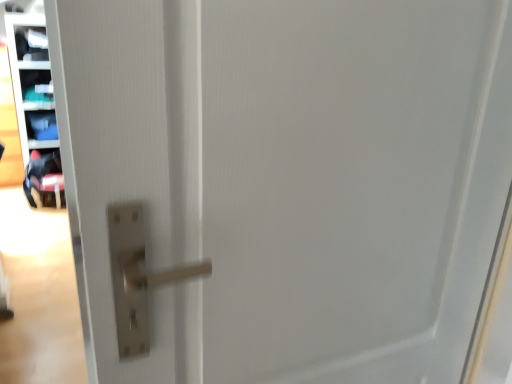
Question: Are matte plastic shelf at upper left, which ranks as the 3th shelf in bottom-to-top order, and matte plastic shelf at upper left, the fourth shelf ordered from the bottom, beside each other?

Choices:
 (A) no
 (B) yes

Answer: (A)

Question: Considering the relative positions of matte plastic shelf at upper left, which ranks as the 3th shelf in bottom-to-top order, and matte plastic shelf at upper left, the fourth shelf ordered from the bottom, in the image provided, is matte plastic shelf at upper left, which ranks as the 3th shelf in bottom-to-top order, to the left of matte plastic shelf at upper left, the fourth shelf ordered from the bottom, from the viewer's perspective?

Choices:
 (A) yes
 (B) no

Answer: (A)

Question: Is the depth of matte plastic shelf at upper left, which ranks as the 3th shelf in bottom-to-top order, less than that of matte plastic shelf at upper left, the fourth shelf ordered from the bottom?

Choices:
 (A) yes
 (B) no

Answer: (B)

Question: Is matte plastic shelf at upper left, which ranks as the 3th shelf in bottom-to-top order, to the right of matte plastic shelf at upper left, the first shelf positioned from the top, from the viewer's perspective?

Choices:
 (A) no
 (B) yes

Answer: (A)

Question: Is matte plastic shelf at upper left, the 2th shelf viewed from the top, not near matte plastic shelf at upper left, the fourth shelf ordered from the bottom?

Choices:
 (A) no
 (B) yes

Answer: (A)

Question: Considering the positions of matte plastic shelf at upper left, the fourth shelf ordered from the bottom, and matte plastic shelf at left, arranged as the first shelf when ordered from the bottom, in the image, is matte plastic shelf at upper left, the fourth shelf ordered from the bottom, taller or shorter than matte plastic shelf at left, arranged as the first shelf when ordered from the bottom,?

Choices:
 (A) tall
 (B) short

Answer: (A)

Question: Based on their positions, is matte plastic shelf at upper left, the fourth shelf ordered from the bottom, located to the left or right of matte plastic shelf at left, placed as the fourth shelf when sorted from top to bottom?

Choices:
 (A) left
 (B) right

Answer: (B)

Question: Is matte plastic shelf at upper left, the first shelf positioned from the top, bigger or smaller than matte plastic shelf at left, placed as the fourth shelf when sorted from top to bottom?

Choices:
 (A) small
 (B) big

Answer: (B)

Question: From the image's perspective, is matte plastic shelf at upper left, the first shelf positioned from the top, positioned above or below matte plastic shelf at left, placed as the fourth shelf when sorted from top to bottom?

Choices:
 (A) below
 (B) above

Answer: (B)

Question: Based on their sizes in the image, would you say matte plastic shelf at upper left, which ranks as the 3th shelf in bottom-to-top order, is bigger or smaller than matte plastic shelf at left, placed as the fourth shelf when sorted from top to bottom?

Choices:
 (A) big
 (B) small

Answer: (A)

Question: Considering the positions of matte plastic shelf at upper left, the 2th shelf viewed from the top, and matte plastic shelf at left, placed as the fourth shelf when sorted from top to bottom, in the image, is matte plastic shelf at upper left, the 2th shelf viewed from the top, wider or thinner than matte plastic shelf at left, placed as the fourth shelf when sorted from top to bottom,?

Choices:
 (A) wide
 (B) thin

Answer: (A)

Question: From a real-world perspective, is matte plastic shelf at upper left, the 2th shelf viewed from the top, physically located above or below matte plastic shelf at left, placed as the fourth shelf when sorted from top to bottom?

Choices:
 (A) above
 (B) below

Answer: (A)

Question: Is matte plastic shelf at upper left, the 2th shelf viewed from the top, spatially inside matte plastic shelf at left, placed as the fourth shelf when sorted from top to bottom, or outside of it?

Choices:
 (A) inside
 (B) outside

Answer: (B)

Question: In terms of size, does matte plastic shelf at upper left, which ranks as the 3th shelf in bottom-to-top order, appear bigger or smaller than matte plastic shelf at upper left, the first shelf positioned from the top?

Choices:
 (A) small
 (B) big

Answer: (B)

Question: From the image's perspective, is matte plastic shelf at upper left, which ranks as the 3th shelf in bottom-to-top order, positioned above or below matte plastic shelf at upper left, the first shelf positioned from the top?

Choices:
 (A) below
 (B) above

Answer: (A)